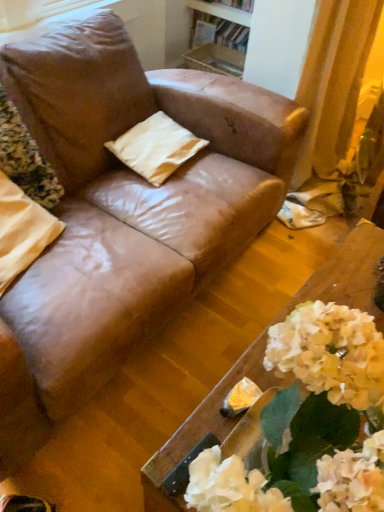
Question: Can you confirm if wooden bookshelf at upper center is wider than matte brown pillow at upper left?

Choices:
 (A) yes
 (B) no

Answer: (B)

Question: Are wooden bookshelf at upper center and matte brown pillow at upper left far apart?

Choices:
 (A) yes
 (B) no

Answer: (A)

Question: Can you confirm if wooden bookshelf at upper center is smaller than matte brown pillow at upper left?

Choices:
 (A) no
 (B) yes

Answer: (B)

Question: Is wooden bookshelf at upper center turned away from matte brown pillow at upper left?

Choices:
 (A) no
 (B) yes

Answer: (A)

Question: Considering the relative sizes of wooden bookshelf at upper center and matte brown pillow at upper left in the image provided, is wooden bookshelf at upper center shorter than matte brown pillow at upper left?

Choices:
 (A) no
 (B) yes

Answer: (B)

Question: Is wooden bookshelf at upper center thinner than matte brown pillow at upper left?

Choices:
 (A) no
 (B) yes

Answer: (B)

Question: Does wooden table at lower right appear on the right side of beige fabric pillow at center, the 2th pillow viewed from the front?

Choices:
 (A) no
 (B) yes

Answer: (B)

Question: Can you confirm if wooden table at lower right is bigger than beige fabric pillow at center, the 2th pillow viewed from the front?

Choices:
 (A) yes
 (B) no

Answer: (A)

Question: From the image's perspective, is wooden table at lower right located above beige fabric pillow at center, the 2th pillow viewed from the front?

Choices:
 (A) no
 (B) yes

Answer: (A)

Question: Is wooden table at lower right outside beige fabric pillow at center, the second pillow when ordered from left to right?

Choices:
 (A) no
 (B) yes

Answer: (B)

Question: From a real-world perspective, is wooden table at lower right beneath beige fabric pillow at center, the second pillow when ordered from left to right?

Choices:
 (A) yes
 (B) no

Answer: (B)

Question: From a real-world perspective, is wooden table at lower right over beige fabric pillow at center, the second pillow when ordered from left to right?

Choices:
 (A) no
 (B) yes

Answer: (B)

Question: Is wooden bookshelf at upper center looking in the opposite direction of beige fabric pillow at center, placed as the first pillow when sorted from back to front?

Choices:
 (A) yes
 (B) no

Answer: (B)